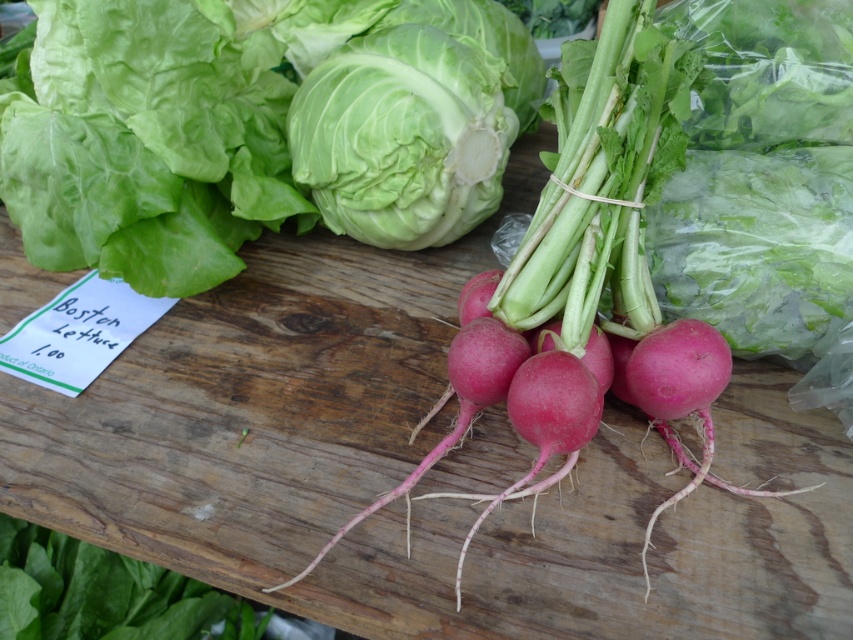
Who is shorter, smooth red radish at center or white crisp lettuce at center?

Standing shorter between the two is white crisp lettuce at center.

Can you confirm if smooth red radish at center is shorter than white crisp lettuce at center?

No, smooth red radish at center is not shorter than white crisp lettuce at center.

The width and height of the screenshot is (853, 640). Identify the location of smooth red radish at center. (585, 288).